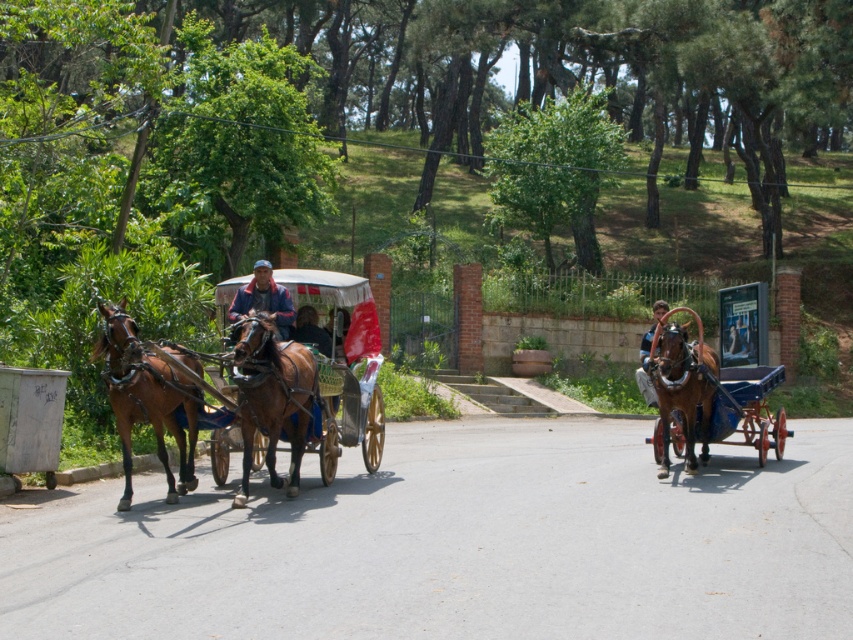
You are a tourist standing on the side of the road and want to take a photo of both the shiny brown cart at center and the brown glossy horse at left. Which object should you focus on first to ensure it appears larger in your photo?

The shiny brown cart at center has a larger size compared to the brown glossy horse at left, so you should focus on the shiny brown cart at center first to ensure it appears larger in the photo.

You are a photographer standing on the side of the road. You want to take a photo that includes both the shiny brown cart at center and the brown glossy horse at center. Which object should you focus on first if you want to ensure both are in frame?

The shiny brown cart at center is bigger than the brown glossy horse at center, so you should focus on the shiny brown cart at center first to ensure both are in frame.

Based on the scene described, where is the shiny brown cart at center located relative to the brown glossy horse at center?

The shiny brown cart at center is located to the right of the brown glossy horse at center.